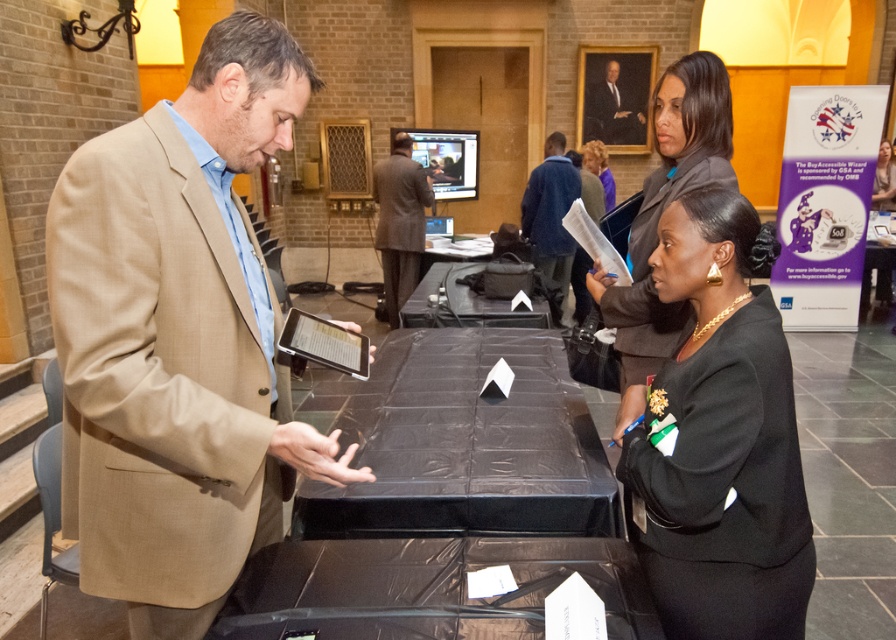
What do you see at coordinates (666, 205) in the screenshot? The image size is (896, 640). I see `black fabric jacket at upper right` at bounding box center [666, 205].

Is black fabric jacket at upper right closer to camera compared to purple fabric shirt at center?

That is True.

What do you see at coordinates (666, 205) in the screenshot? I see `black fabric jacket at upper right` at bounding box center [666, 205].

The image size is (896, 640). Identify the location of black fabric jacket at upper right. 666,205.

From the picture: Does blue woolen sweater at center have a lesser width compared to purple fabric shirt at center?

In fact, blue woolen sweater at center might be wider than purple fabric shirt at center.

Between blue woolen sweater at center and purple fabric shirt at center, which one has less height?

purple fabric shirt at center is shorter.

Who is more distant from viewer, (567, 268) or (605, 196)?

The point (605, 196) is behind.

Find the location of `blue woolen sweater at center`. blue woolen sweater at center is located at coordinates (550, 211).

Does point (410, 276) lie behind point (601, 173)?

No, (410, 276) is closer to viewer.

Between gray suit at center and purple fabric shirt at center, which one has less height?

purple fabric shirt at center is shorter.

Who is more distant from viewer, (409, 227) or (587, 168)?

Point (587, 168)

Where is `gray suit at center`? gray suit at center is located at coordinates (401, 221).